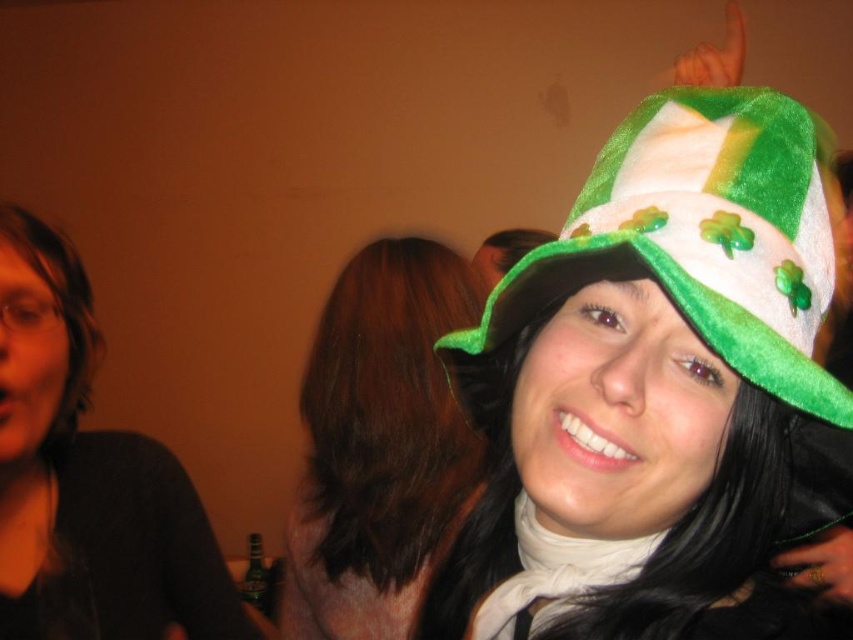
Question: Does green fuzzy hat at upper right have a lesser width compared to matte black shirt at left?

Choices:
 (A) no
 (B) yes

Answer: (A)

Question: Which point is closer to the camera?

Choices:
 (A) (701, 218)
 (B) (352, 506)
 (C) (105, 513)

Answer: (A)

Question: Estimate the real-world distances between objects in this image. Which object is farther from the matte black shirt at left?

Choices:
 (A) green fuzzy hat at upper right
 (B) green fuzzy hat at upper center

Answer: (A)

Question: Which of the following is the farthest from the observer?

Choices:
 (A) (737, 237)
 (B) (434, 497)
 (C) (30, 368)

Answer: (B)

Question: Does green fuzzy hat at upper right appear on the right side of matte black shirt at left?

Choices:
 (A) yes
 (B) no

Answer: (A)

Question: Is green fuzzy hat at upper right bigger than green fuzzy hat at upper center?

Choices:
 (A) yes
 (B) no

Answer: (B)